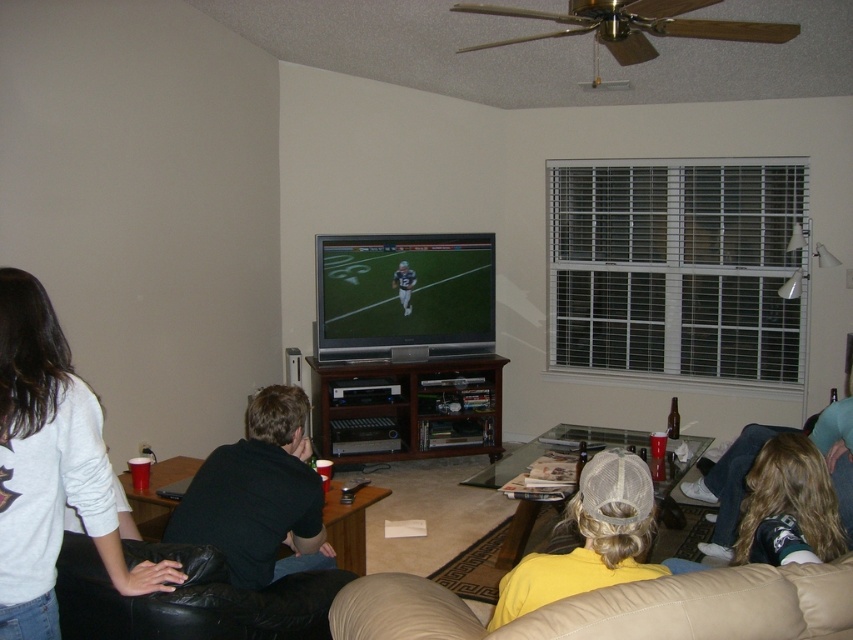
You are sitting on the beige leather couch at lower right and want to hand a snack to the person wearing the black cotton shirt at center. Can you reach them without moving from your seat?

The beige leather couch at lower right is located below the black cotton shirt at center, so you can likely reach them by extending your arm upwards.

You are a guest in the living room and want to sit on the beige leather couch at lower right. However, you notice the black cotton shirt at center is placed on the couch. Can you sit there without moving the shirt?

The beige leather couch at lower right has a lesser height compared to black cotton shirt at center, so the shirt might not be resting on the couch. Therefore, you can sit there without moving the shirt.